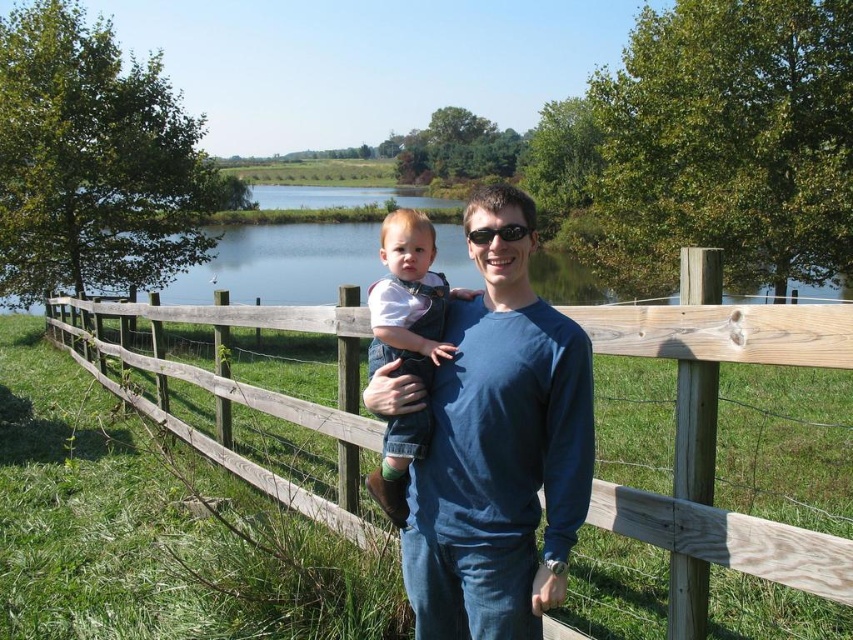
Who is positioned more to the left, wooden fence at center or blue water at center?

blue water at center

Is point (113, 342) behind point (579, 294)?

No, (113, 342) is closer to viewer.

Identify the location of wooden fence at center. The image size is (853, 640). (714, 442).

Can you confirm if wooden fence at center is positioned to the right of denim overall at center?

In fact, wooden fence at center is to the left of denim overall at center.

Between wooden fence at center and denim overall at center, which one appears on the left side from the viewer's perspective?

wooden fence at center

Locate an element on the screen. This screenshot has height=640, width=853. wooden fence at center is located at coordinates (714, 442).

What do you see at coordinates (714, 442) in the screenshot?
I see `wooden fence at center` at bounding box center [714, 442].

Who is taller, wooden fence at center or blue cotton shirt at center?

Standing taller between the two is blue cotton shirt at center.

Is point (683, 518) less distant than point (508, 512)?

No, it is not.

Identify the location of wooden fence at center. (714, 442).